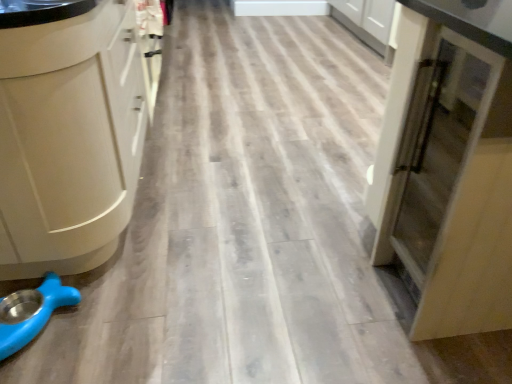
What is the approximate height of matte white cabinet at left?

matte white cabinet at left is 35.91 inches tall.

What is the approximate height of blue rubber pet bowl at lower left?

The height of blue rubber pet bowl at lower left is 3.56 inches.

Find the location of a particular element. This screenshot has width=512, height=384. matte white cabinet at left is located at coordinates pyautogui.click(x=72, y=136).

From the image's perspective, is blue rubber pet bowl at lower left below matte wood cupboard at right?

Yes, from the image's perspective, blue rubber pet bowl at lower left is below matte wood cupboard at right.

Looking at this image, from their relative heights in the image, would you say blue rubber pet bowl at lower left is taller or shorter than matte wood cupboard at right?

Considering their sizes, blue rubber pet bowl at lower left has less height than matte wood cupboard at right.

From the picture: How many degrees apart are the facing directions of blue rubber pet bowl at lower left and matte wood cupboard at right?

There is a 139-degree angle between the facing directions of blue rubber pet bowl at lower left and matte wood cupboard at right.

Considering the points (12, 307) and (451, 224), which point is in front, point (12, 307) or point (451, 224)?

The point (451, 224) is closer to the camera.

Consider the image. Would you say matte wood cupboard at right is inside or outside matte white cabinet at left?

matte wood cupboard at right is outside matte white cabinet at left.

Identify the location of cupboard that is in front of the matte white cabinet at left. This screenshot has width=512, height=384. (449, 165).

Between matte wood cupboard at right and matte white cabinet at left, which one has less height?

matte wood cupboard at right.

In the scene shown: Is there a large distance between matte wood cupboard at right and matte white cabinet at left?

They are positioned close to each other.

Is matte white cabinet at left bigger than matte wood cupboard at right?

Correct, matte white cabinet at left is larger in size than matte wood cupboard at right.

Looking at this image, is matte white cabinet at left turned away from matte wood cupboard at right?

That's not correct — matte white cabinet at left is not looking away from matte wood cupboard at right.

Considering the positions of objects matte white cabinet at left and matte wood cupboard at right in the image provided, who is more to the right, matte white cabinet at left or matte wood cupboard at right?

Positioned to the right is matte wood cupboard at right.

I want to click on cupboard below the matte white cabinet at left (from the image's perspective), so click(449, 165).

You are a GUI agent. You are given a task and a screenshot of the screen. Output one action in this format:
    pyautogui.click(x=<x>, y=<y>)
    Task: Click on the cabinetry in front of the blue rubber pet bowl at lower left
    
    Given the screenshot: What is the action you would take?
    pyautogui.click(x=72, y=136)

Do you think blue rubber pet bowl at lower left is within matte white cabinet at left, or outside of it?

blue rubber pet bowl at lower left cannot be found inside matte white cabinet at left.

In the scene shown: Is blue rubber pet bowl at lower left positioned with its back to matte white cabinet at left?

Yes.

Is matte white cabinet at left looking in the opposite direction of blue rubber pet bowl at lower left?

matte white cabinet at left is not turned away from blue rubber pet bowl at lower left.

From the picture: Between matte white cabinet at left and blue rubber pet bowl at lower left, which one has more height?

matte white cabinet at left is taller.

Measure the distance from matte white cabinet at left to blue rubber pet bowl at lower left.

They are 14.52 inches apart.

Can you confirm if matte white cabinet at left is smaller than blue rubber pet bowl at lower left?

No.

Is matte wood cupboard at right not near blue rubber pet bowl at lower left?

Indeed, matte wood cupboard at right is not near blue rubber pet bowl at lower left.

Does matte wood cupboard at right have a smaller size compared to blue rubber pet bowl at lower left?

No.

How many degrees apart are the facing directions of matte wood cupboard at right and blue rubber pet bowl at lower left?

The angle between the facing direction of matte wood cupboard at right and the facing direction of blue rubber pet bowl at lower left is 139 degrees.

This screenshot has width=512, height=384. What are the coordinates of `cupboard above the blue rubber pet bowl at lower left (from a real-world perspective)` in the screenshot? It's located at (449, 165).

Identify the location of cabinetry lying on the left of matte wood cupboard at right. (72, 136).

When comparing their distances from blue rubber pet bowl at lower left, does matte wood cupboard at right or matte white cabinet at left seem closer?

matte white cabinet at left.

Based on the photo, considering their positions, is blue rubber pet bowl at lower left positioned closer to matte wood cupboard at right than matte white cabinet at left?

Among the two, matte white cabinet at left is located nearer to matte wood cupboard at right.

Based on the photo, considering their positions, is matte wood cupboard at right positioned further to matte white cabinet at left than blue rubber pet bowl at lower left?

The object further to matte white cabinet at left is matte wood cupboard at right.

When comparing their distances from matte wood cupboard at right, does matte white cabinet at left or blue rubber pet bowl at lower left seem further?

The object further to matte wood cupboard at right is blue rubber pet bowl at lower left.

Estimate the real-world distances between objects in this image. Which object is closer to matte white cabinet at left, blue rubber pet bowl at lower left or matte wood cupboard at right?

blue rubber pet bowl at lower left lies closer to matte white cabinet at left than the other object.

Based on their spatial positions, is matte white cabinet at left or matte wood cupboard at right further from blue rubber pet bowl at lower left?

The object further to blue rubber pet bowl at lower left is matte wood cupboard at right.

Locate an element on the screen. This screenshot has height=384, width=512. appliance situated between matte white cabinet at left and matte wood cupboard at right from left to right is located at coordinates (31, 312).